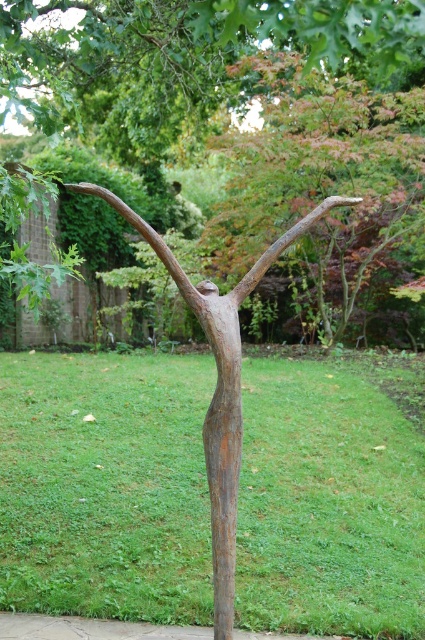
Question: Where is rusty metal tree at center located in relation to brown rough tree trunk at center in the image?

Choices:
 (A) right
 (B) left

Answer: (A)

Question: Which of the following is the farthest from the observer?

Choices:
 (A) rusty metal tree at center
 (B) brown rough tree trunk at center

Answer: (B)

Question: Which point is farther from the camera taking this photo?

Choices:
 (A) (238, 324)
 (B) (144, 38)

Answer: (B)

Question: Can you confirm if rusty metal tree at center is bigger than brown rough tree trunk at center?

Choices:
 (A) no
 (B) yes

Answer: (B)

Question: Does rusty metal tree at center have a greater width compared to brown rough tree trunk at center?

Choices:
 (A) yes
 (B) no

Answer: (A)

Question: Among these objects, which one is farthest from the camera?

Choices:
 (A) rusty metal tree at center
 (B) brown rough tree trunk at center

Answer: (B)